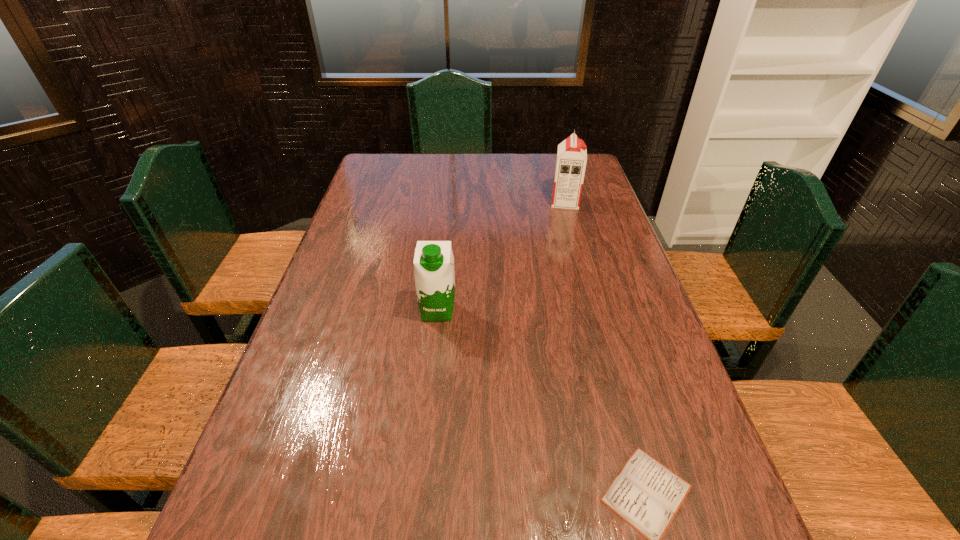
Find the location of a particular element. The width and height of the screenshot is (960, 540). free region at the far right corner of the desktop is located at coordinates (593, 166).

At what (x,y) coordinates should I click in order to perform the action: click on free spot between the second farthest object and the farthest object. Please return your answer as a coordinate pair (x, y). This screenshot has width=960, height=540. Looking at the image, I should click on (501, 256).

Find the location of `vacant point located between the farther soya milk and the leftmost object`. vacant point located between the farther soya milk and the leftmost object is located at coordinates (501, 256).

This screenshot has height=540, width=960. I want to click on vacant area between the farthest object and the leftmost object, so click(501, 256).

This screenshot has width=960, height=540. I want to click on empty space that is in between the farther soya milk and the leftmost object, so click(501, 256).

Find the location of a particular element. blank region between the right soya milk and the left soya milk is located at coordinates (501, 256).

Select which object appears as the second closest to the nearer soya milk. Please provide its 2D coordinates. Your answer should be formatted as a tuple, i.e. [(x, y)], where the tuple contains the x and y coordinates of a point satisfying the conditions above.

[(571, 160)]

You are a GUI agent. You are given a task and a screenshot of the screen. Output one action in this format:
    pyautogui.click(x=<x>, y=<y>)
    Task: Click on the object that can be found as the second closest to the nearer soya milk
    Image resolution: width=960 pixels, height=540 pixels.
    Given the screenshot: What is the action you would take?
    pyautogui.click(x=571, y=160)